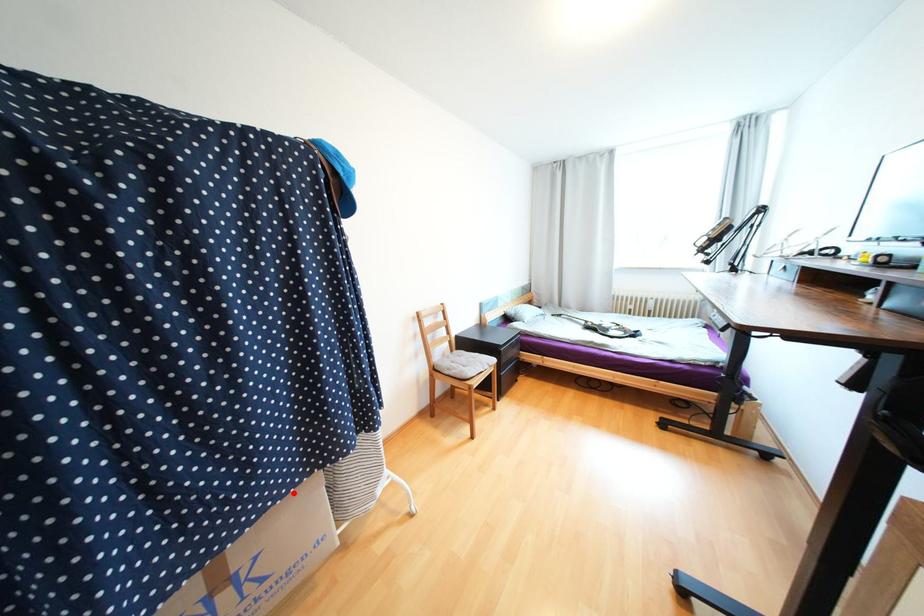
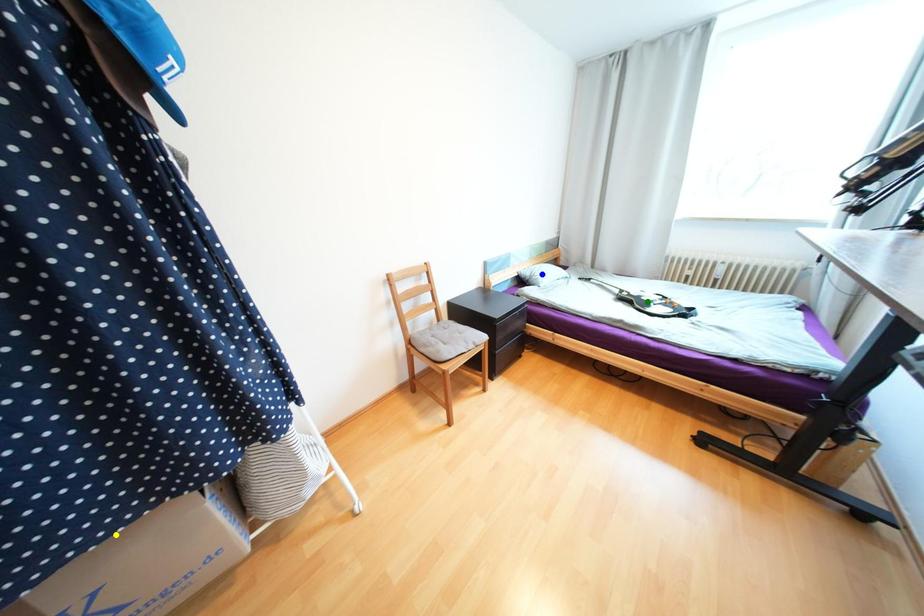
Question: I am providing you with two images of the same scene from different viewpoints. A red point is marked on the first image. You are given multiple points on the second image. Can you choose the point in image 2 that corresponds to the point in image 1?

Choices:
 (A) green point
 (B) yellow point
 (C) blue point

Answer: (B)